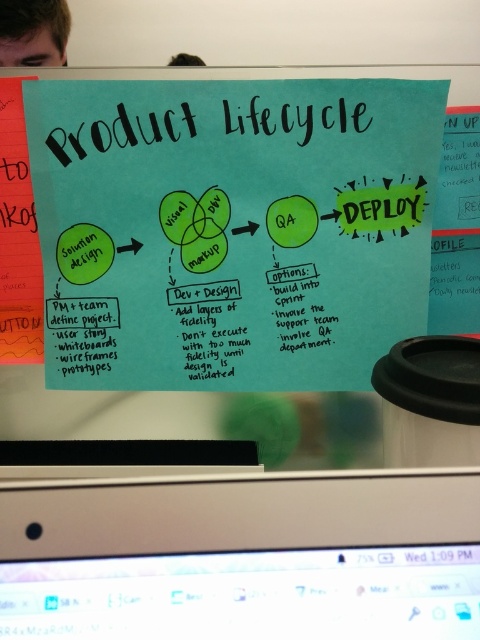
What do you see at coordinates (231, 228) in the screenshot? I see `blue paper poster at center` at bounding box center [231, 228].

This screenshot has height=640, width=480. I want to click on blue paper poster at center, so click(231, 228).